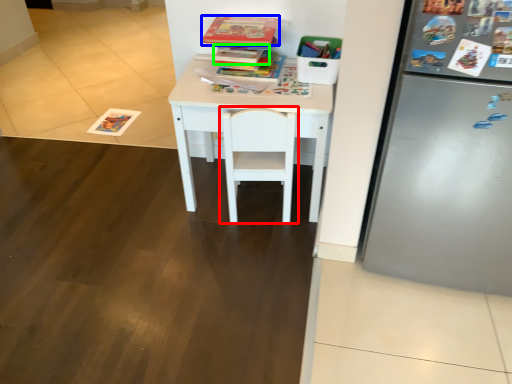
Question: Estimate the real-world distances between objects in this image. Which object is closer to chair (highlighted by a red box), book (highlighted by a blue box) or book (highlighted by a green box)?

Choices:
 (A) book
 (B) book

Answer: (B)